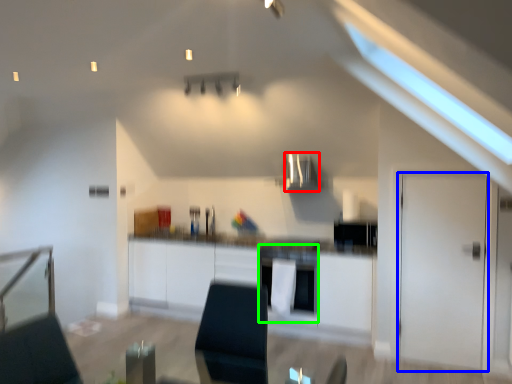
Question: Which object is the farthest from exhaust hood (highlighted by a red box)? Choose among these: door (highlighted by a blue box) or oven (highlighted by a green box).

Choices:
 (A) door
 (B) oven

Answer: (A)